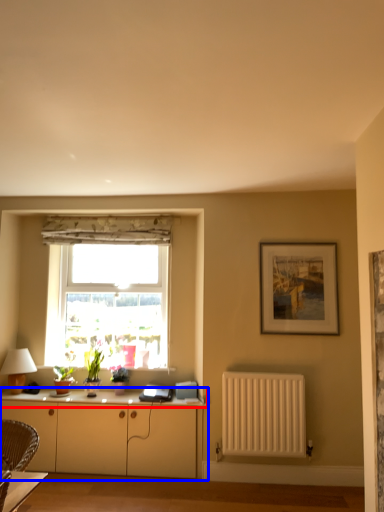
Question: Which object appears closest to the camera in this image, counter top (highlighted by a red box) or cabinetry (highlighted by a blue box)?

Choices:
 (A) counter top
 (B) cabinetry

Answer: (B)